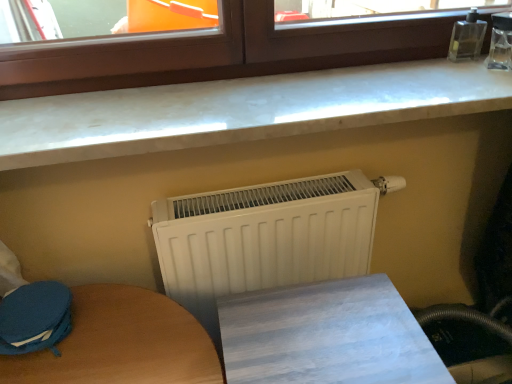
Question: From the image's perspective, does brown wood window at upper center appear lower than white matte radiator at center?

Choices:
 (A) yes
 (B) no

Answer: (B)

Question: Is brown wood window at upper center not within white matte radiator at center?

Choices:
 (A) no
 (B) yes

Answer: (B)

Question: Does brown wood window at upper center contain white matte radiator at center?

Choices:
 (A) no
 (B) yes

Answer: (A)

Question: From the image's perspective, does brown wood window at upper center appear higher than white matte radiator at center?

Choices:
 (A) no
 (B) yes

Answer: (B)

Question: Is brown wood window at upper center oriented towards white matte radiator at center?

Choices:
 (A) no
 (B) yes

Answer: (A)

Question: Is brown wood window at upper center closer to camera compared to white matte radiator at center?

Choices:
 (A) yes
 (B) no

Answer: (A)

Question: Is blue fabric swivel chair at lower left beside white matte radiator at center?

Choices:
 (A) no
 (B) yes

Answer: (A)

Question: Can you confirm if blue fabric swivel chair at lower left is thinner than white matte radiator at center?

Choices:
 (A) no
 (B) yes

Answer: (A)

Question: Is blue fabric swivel chair at lower left at the right side of white matte radiator at center?

Choices:
 (A) yes
 (B) no

Answer: (B)

Question: From the image's perspective, is blue fabric swivel chair at lower left on top of white matte radiator at center?

Choices:
 (A) yes
 (B) no

Answer: (B)

Question: Does blue fabric swivel chair at lower left appear on the left side of white matte radiator at center?

Choices:
 (A) no
 (B) yes

Answer: (B)

Question: From a real-world perspective, is blue fabric swivel chair at lower left located higher than white matte radiator at center?

Choices:
 (A) yes
 (B) no

Answer: (A)

Question: Would you say blue fabric swivel chair at lower left is part of wooden table at lower center's contents?

Choices:
 (A) no
 (B) yes

Answer: (A)